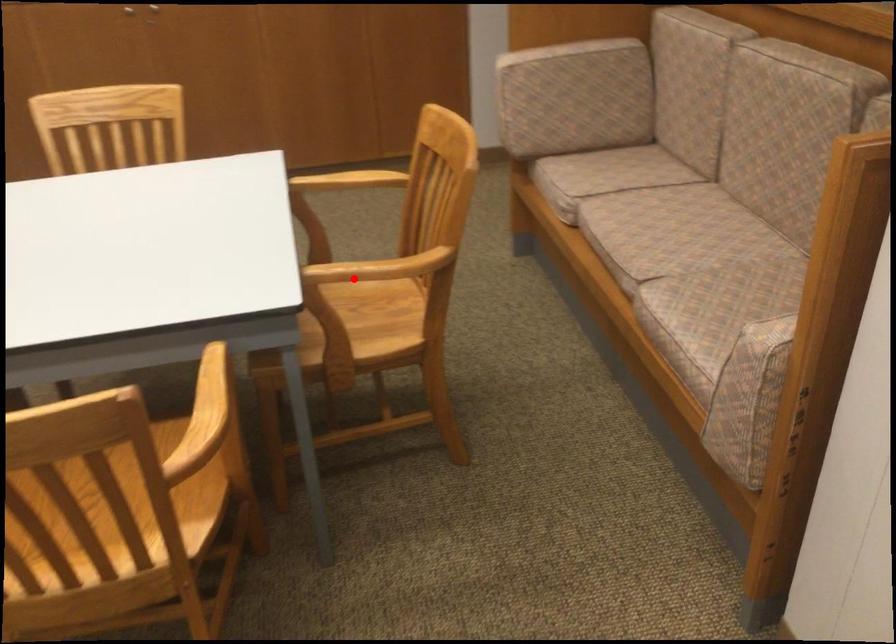
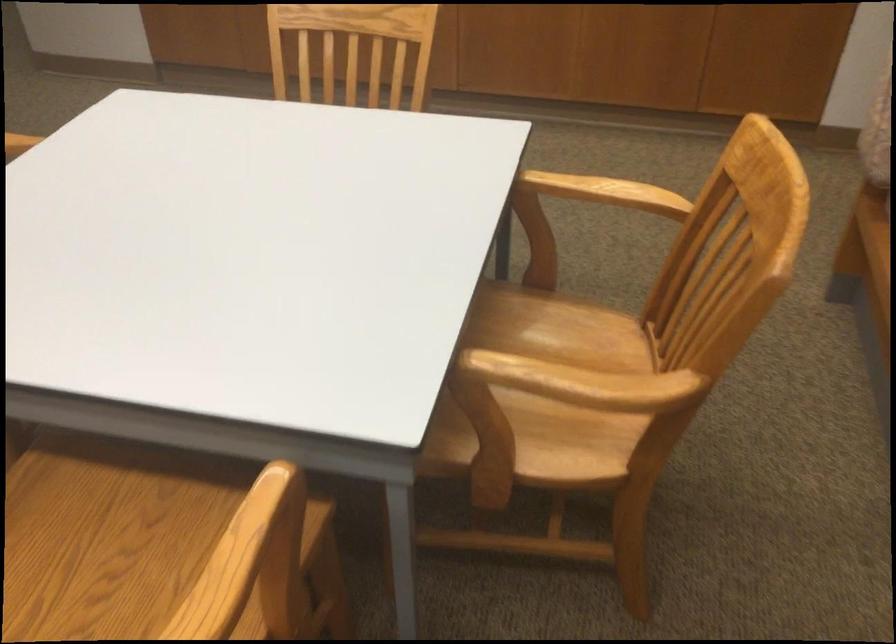
Find the pixel in the second image that matches the highlighted location in the first image.

(567, 330)